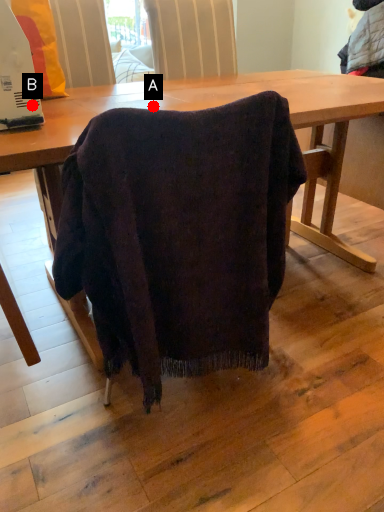
Question: Two points are circled on the image, labeled by A and B beside each circle. Which point is closer to the camera?

Choices:
 (A) A is closer
 (B) B is closer

Answer: (B)